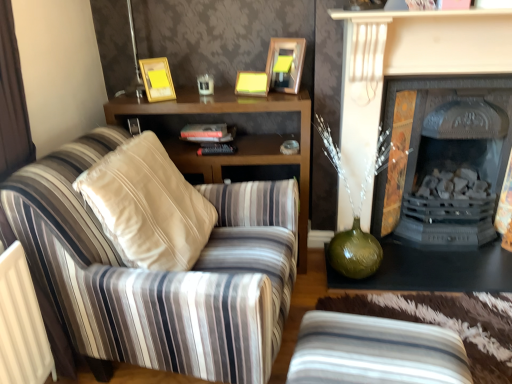
Question: Based on their positions, is wooden cabinet at center located to the left or right of striped fabric armchair at left?

Choices:
 (A) right
 (B) left

Answer: (A)

Question: Do you think wooden cabinet at center is within striped fabric armchair at left, or outside of it?

Choices:
 (A) inside
 (B) outside

Answer: (B)

Question: Which is nearer to the wooden cabinet at center?

Choices:
 (A) matte black fireplace at center, acting as the second fireplace starting from the back
 (B) striped fabric studio couch at lower center
 (C) hardcover book at center
 (D) black cast iron fireplace at right, which is counted as the 2th fireplace, starting from the front
 (E) striped fabric armchair at left

Answer: (C)

Question: Which object is the closest to the striped fabric studio couch at lower center?

Choices:
 (A) black cast iron fireplace at right, which ranks as the first fireplace in back-to-front order
 (B) wooden cabinet at center
 (C) striped fabric armchair at left
 (D) hardcover book at center
 (E) gold metallic picture frame at upper center, the first picture frame from the left

Answer: (C)